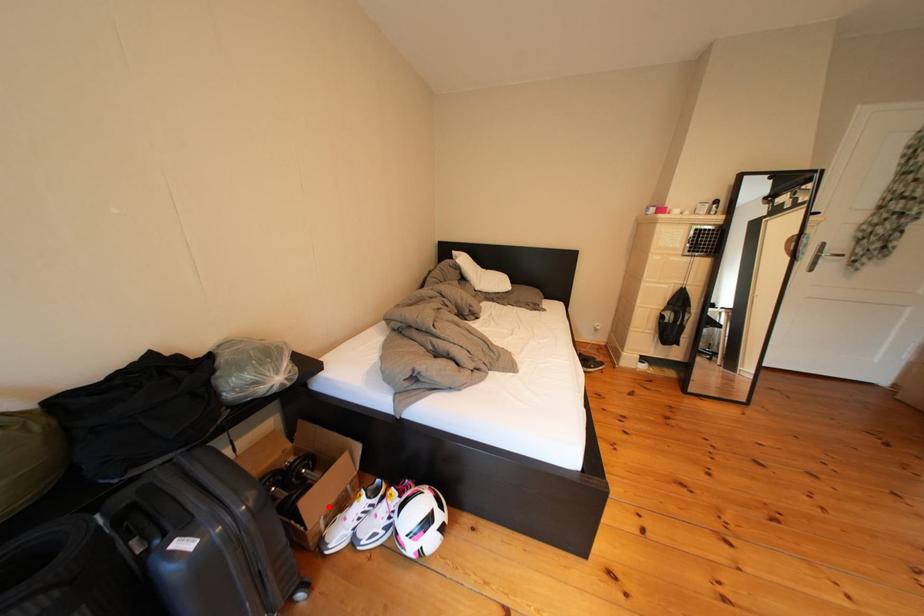
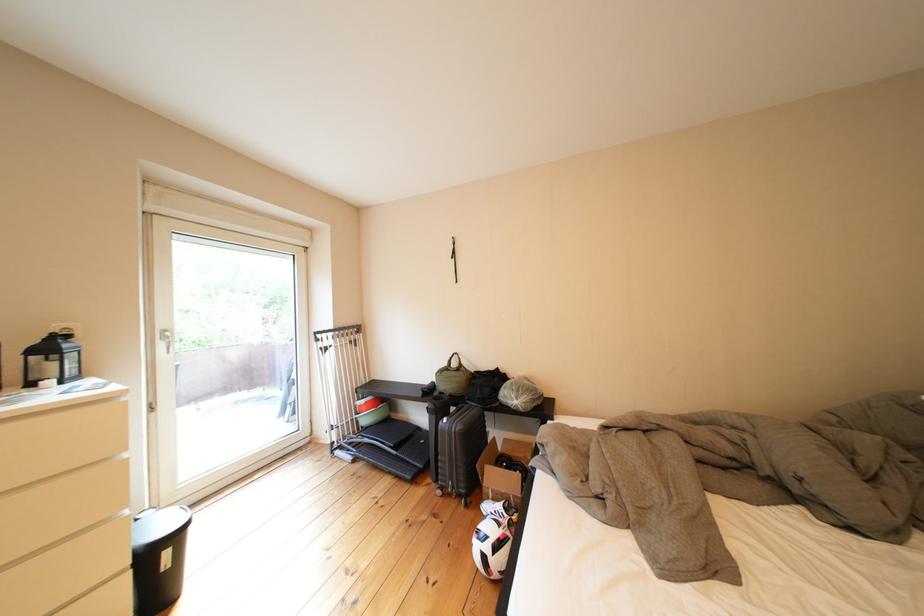
Where in the second image is the point corresponding to the highlighted location from the first image?

(505, 480)